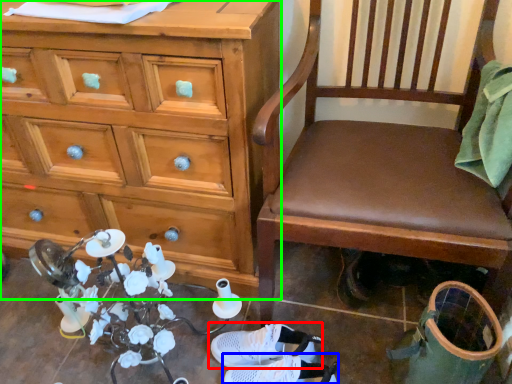
Question: Which is nearer to the footwear (highlighted by a red box)? footwear (highlighted by a blue box) or chest of drawers (highlighted by a green box).

Choices:
 (A) footwear
 (B) chest of drawers

Answer: (A)